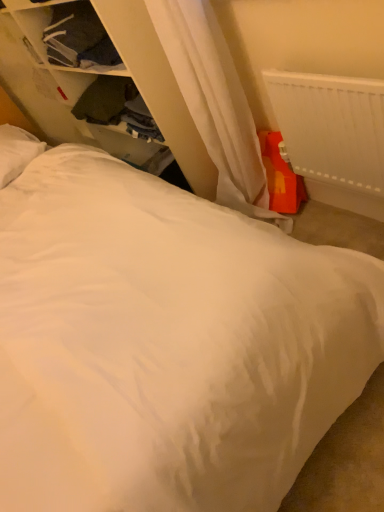
Question: Can you confirm if white soft pillow at upper left is wider than dark blue fabric at upper left, placed as the first clothing when sorted from top to bottom?

Choices:
 (A) yes
 (B) no

Answer: (A)

Question: Can you confirm if white soft pillow at upper left is shorter than dark blue fabric at upper left, the 2th clothing positioned from the bottom?

Choices:
 (A) yes
 (B) no

Answer: (B)

Question: Does white soft pillow at upper left lie behind dark blue fabric at upper left, the 2th clothing positioned from the bottom?

Choices:
 (A) no
 (B) yes

Answer: (B)

Question: From the image's perspective, is white soft pillow at upper left beneath dark blue fabric at upper left, placed as the first clothing when sorted from top to bottom?

Choices:
 (A) no
 (B) yes

Answer: (B)

Question: Considering the relative positions of white soft pillow at upper left and dark blue fabric at upper left, placed as the first clothing when sorted from top to bottom, in the image provided, is white soft pillow at upper left in front of dark blue fabric at upper left, placed as the first clothing when sorted from top to bottom,?

Choices:
 (A) no
 (B) yes

Answer: (A)

Question: Is dark blue fabric at upper left, the 2th clothing positioned from the bottom, wider or thinner than dark green fabric at upper left, the 1th clothing in the bottom-to-top sequence?

Choices:
 (A) wide
 (B) thin

Answer: (B)

Question: From a real-world perspective, is dark blue fabric at upper left, the 2th clothing positioned from the bottom, above or below dark green fabric at upper left, positioned as the 2th clothing in top-to-bottom order?

Choices:
 (A) below
 (B) above

Answer: (B)

Question: Considering the positions of point (56, 26) and point (130, 129), is point (56, 26) closer or farther from the camera than point (130, 129)?

Choices:
 (A) closer
 (B) farther

Answer: (A)

Question: Visually, is dark blue fabric at upper left, the 2th clothing positioned from the bottom, positioned to the left or to the right of dark green fabric at upper left, positioned as the 2th clothing in top-to-bottom order?

Choices:
 (A) right
 (B) left

Answer: (B)

Question: Considering the positions of white soft pillow at upper left and dark blue fabric at upper left, placed as the first clothing when sorted from top to bottom, in the image, is white soft pillow at upper left taller or shorter than dark blue fabric at upper left, placed as the first clothing when sorted from top to bottom,?

Choices:
 (A) short
 (B) tall

Answer: (B)

Question: Is point (11, 135) positioned closer to the camera than point (72, 36)?

Choices:
 (A) closer
 (B) farther

Answer: (B)

Question: Is white soft pillow at upper left bigger or smaller than dark blue fabric at upper left, placed as the first clothing when sorted from top to bottom?

Choices:
 (A) big
 (B) small

Answer: (A)

Question: From a real-world perspective, is white soft pillow at upper left positioned above or below dark blue fabric at upper left, placed as the first clothing when sorted from top to bottom?

Choices:
 (A) above
 (B) below

Answer: (B)

Question: In terms of height, does white plastic radiator at upper right look taller or shorter compared to dark green fabric at upper left, positioned as the 2th clothing in top-to-bottom order?

Choices:
 (A) short
 (B) tall

Answer: (B)

Question: Is white plastic radiator at upper right bigger or smaller than dark green fabric at upper left, positioned as the 2th clothing in top-to-bottom order?

Choices:
 (A) big
 (B) small

Answer: (B)